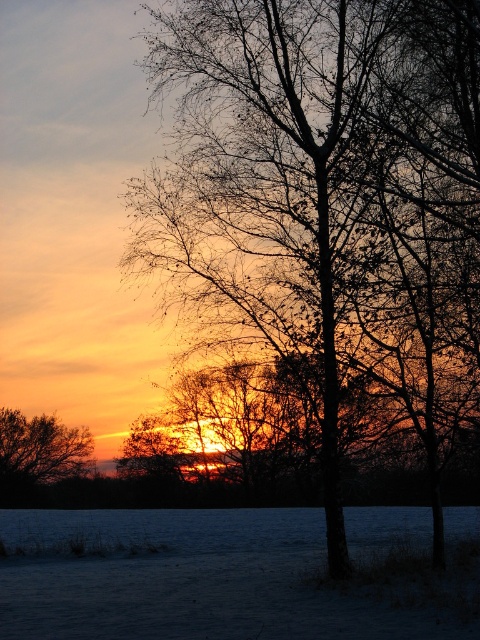
Question: Is brown/dry wood tree at center to the right of brown matte tree at left from the viewer's perspective?

Choices:
 (A) yes
 (B) no

Answer: (A)

Question: Which of the following is the farthest from the observer?

Choices:
 (A) brown matte tree at left
 (B) brown/dry wood tree at center

Answer: (A)

Question: Is brown/dry wood tree at center behind brown matte tree at left?

Choices:
 (A) yes
 (B) no

Answer: (B)

Question: Which of the following is the closest to the observer?

Choices:
 (A) (327, 100)
 (B) (46, 419)

Answer: (A)

Question: Considering the relative positions of brown/dry wood tree at center and brown matte tree at left in the image provided, where is brown/dry wood tree at center located with respect to brown matte tree at left?

Choices:
 (A) left
 (B) right

Answer: (B)

Question: Which point is farther to the camera?

Choices:
 (A) brown matte tree at left
 (B) brown/dry wood tree at center

Answer: (A)